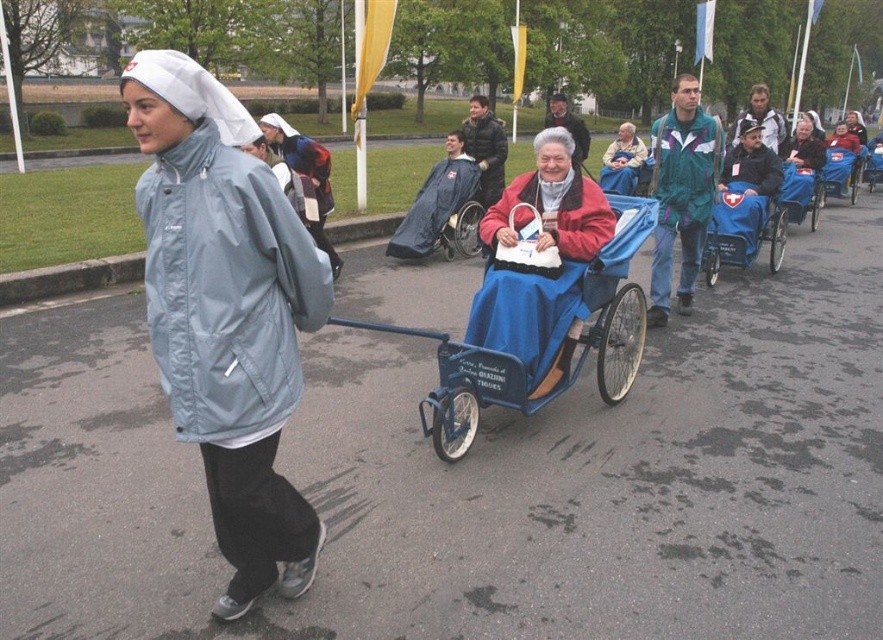
Can you confirm if matte red coat at center is thinner than blue fabric wheelchair at center?

Incorrect, matte red coat at center's width is not less than blue fabric wheelchair at center's.

Is matte red coat at center to the right of blue fabric wheelchair at center from the viewer's perspective?

Indeed, matte red coat at center is positioned on the right side of blue fabric wheelchair at center.

Which is in front, point (547, 164) or point (462, 196)?

Point (547, 164)

What are the coordinates of `matte red coat at center` in the screenshot? It's located at (551, 204).

Who is positioned more to the right, teal/white/green jacket at center or blue fabric wheelchair at center?

Positioned to the right is teal/white/green jacket at center.

Is teal/white/green jacket at center above blue fabric wheelchair at center?

Incorrect, teal/white/green jacket at center is not positioned above blue fabric wheelchair at center.

At what (x,y) coordinates should I click in order to perform the action: click on teal/white/green jacket at center. Please return your answer as a coordinate pair (x, y). The image size is (883, 640). Looking at the image, I should click on (681, 193).

Can you confirm if light blue fabric jacket at left is shorter than teal/white/green jacket at center?

Yes.

Looking at this image, is light blue fabric jacket at left closer to camera compared to teal/white/green jacket at center?

That is True.

Find the location of a particular element. light blue fabric jacket at left is located at coordinates (225, 312).